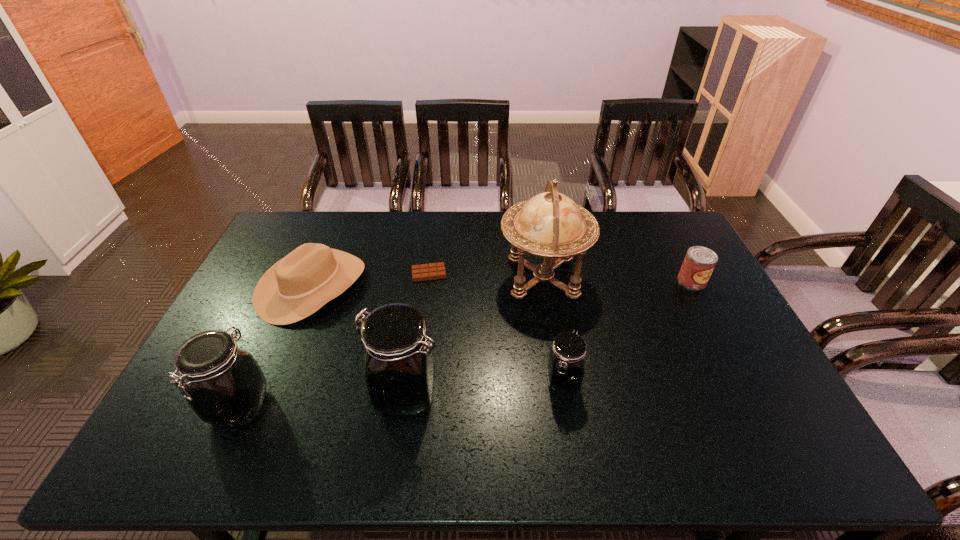
This screenshot has width=960, height=540. Find the location of `vacant point located between the second jar from right to left and the can`. vacant point located between the second jar from right to left and the can is located at coordinates (548, 337).

I want to click on vacant area that lies between the leftmost jar and the rightmost object, so click(x=466, y=344).

Where is `free spot between the shortest jar and the second jar from right to left`? The image size is (960, 540). free spot between the shortest jar and the second jar from right to left is located at coordinates pos(484,387).

I want to click on vacant space in between the rightmost jar and the sixth tallest object, so click(627, 330).

This screenshot has height=540, width=960. I want to click on free space between the rightmost object and the fifth shortest object, so click(x=466, y=344).

Locate an element on the screen. empty location between the shortest object and the cowboy hat is located at coordinates (371, 279).

Where is `free space between the globe and the rightmost jar`? This screenshot has width=960, height=540. free space between the globe and the rightmost jar is located at coordinates (553, 329).

Select which object is the sixth closest to the tallest object. Please provide its 2D coordinates. Your answer should be formatted as a tuple, i.e. [(x, y)], where the tuple contains the x and y coordinates of a point satisfying the conditions above.

[(224, 385)]

Select which object is the fifth closest to the second jar from right to left. Please provide its 2D coordinates. Your answer should be formatted as a tuple, i.e. [(x, y)], where the tuple contains the x and y coordinates of a point satisfying the conditions above.

[(432, 271)]

Find the location of a particular element. This screenshot has width=960, height=540. the closest jar relative to the sixth tallest object is located at coordinates (566, 365).